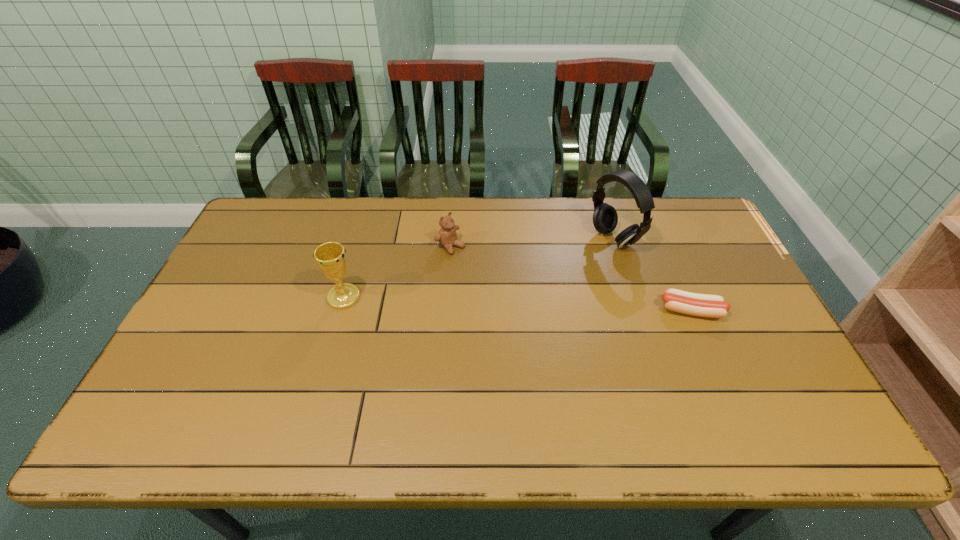
Locate an element on the screen. free point located 0.070m on the ear cups of the tallest object is located at coordinates (580, 258).

You are a GUI agent. You are given a task and a screenshot of the screen. Output one action in this format:
    pyautogui.click(x=<x>, y=<y>)
    Task: Click on the vacant area situated on the face of the teddy bear
    
    Given the screenshot: What is the action you would take?
    pyautogui.click(x=474, y=265)

Locate an element on the screen. The width and height of the screenshot is (960, 540). vacant space situated on the face of the teddy bear is located at coordinates (522, 303).

This screenshot has width=960, height=540. I want to click on blank space located 0.370m on the face of the teddy bear, so click(545, 321).

I want to click on earphone located at the far edge, so click(x=605, y=218).

Where is `teddy bear at the far edge`? The width and height of the screenshot is (960, 540). teddy bear at the far edge is located at coordinates (447, 236).

You are a GUI agent. You are given a task and a screenshot of the screen. Output one action in this format:
    pyautogui.click(x=<x>, y=<y>)
    Task: Click on the object at the right edge
    
    Given the screenshot: What is the action you would take?
    pyautogui.click(x=703, y=305)

Locate an element on the screen. The height and width of the screenshot is (540, 960). vacant region at the far edge of the desktop is located at coordinates (334, 211).

This screenshot has height=540, width=960. In the image, there is a desktop. In order to click on vacant area at the near edge in this screenshot , I will do `click(686, 377)`.

At what (x,y) coordinates should I click in order to perform the action: click on vacant space at the left edge. Please return your answer as a coordinate pair (x, y). Image resolution: width=960 pixels, height=540 pixels. Looking at the image, I should click on pos(204,316).